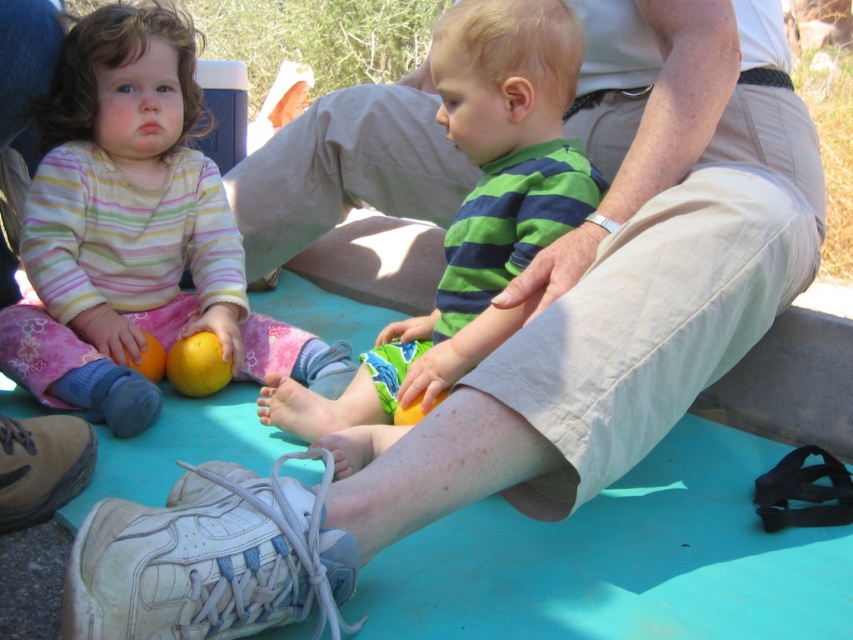
Does matte yellow citrus fruit at lower left have a lesser height compared to green striped shirt at center?

No, matte yellow citrus fruit at lower left is not shorter than green striped shirt at center.

Does matte yellow citrus fruit at lower left come behind green striped shirt at center?

Yes.

Is point (297, 330) positioned after point (518, 144)?

Yes.

This screenshot has width=853, height=640. In order to click on matte yellow citrus fruit at lower left in this screenshot , I will do [134, 230].

Does yellow matte orange at center have a lesser width compared to orange matte at lower left?

No.

Is point (178, 380) positioned before point (142, 355)?

No, (178, 380) is further to viewer.

Identify the location of yellow matte orange at center. The width and height of the screenshot is (853, 640). (196, 365).

Which is more to the left, green striped shirt at center or yellow matte orange at center?

yellow matte orange at center

Is point (560, 74) positioned in front of point (190, 349)?

Yes.

The image size is (853, 640). I want to click on green striped shirt at center, so click(468, 220).

This screenshot has height=640, width=853. Identify the location of green striped shirt at center. (468, 220).